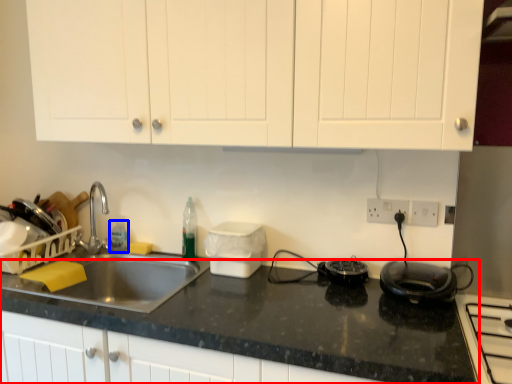
Question: Which of the following is the farthest to the observer, countertop (highlighted by a red box) or bottle (highlighted by a blue box)?

Choices:
 (A) countertop
 (B) bottle

Answer: (B)